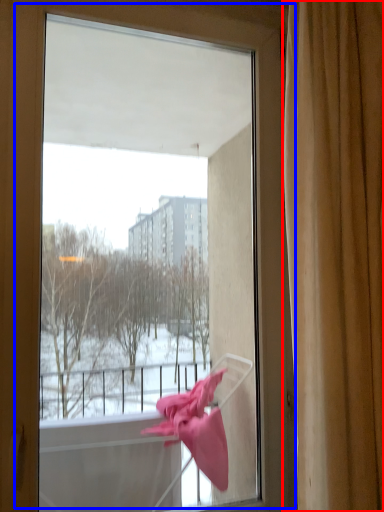
Question: Which of the following is the farthest to the observer, curtain (highlighted by a red box) or window (highlighted by a blue box)?

Choices:
 (A) curtain
 (B) window

Answer: (B)